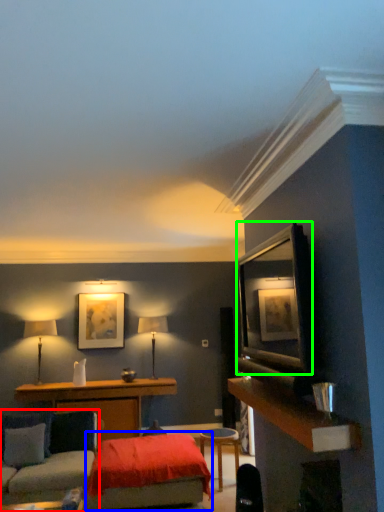
Question: Which object is the closest to the studio couch (highlighted by a red box)? Choose among these: bed (highlighted by a blue box) or shelf (highlighted by a green box).

Choices:
 (A) bed
 (B) shelf

Answer: (A)